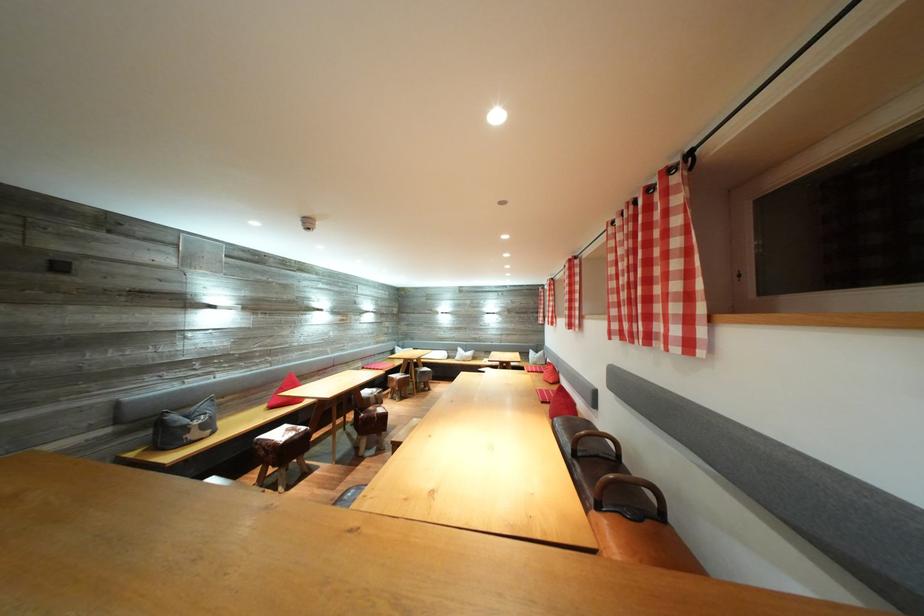
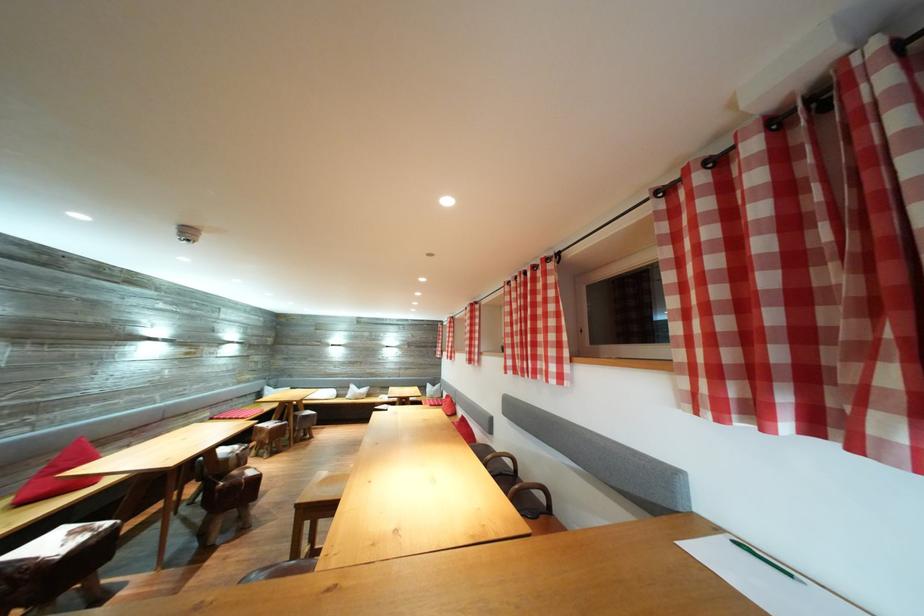
The point at (578, 322) is marked in the first image. Where is the corresponding point in the second image?

(477, 359)